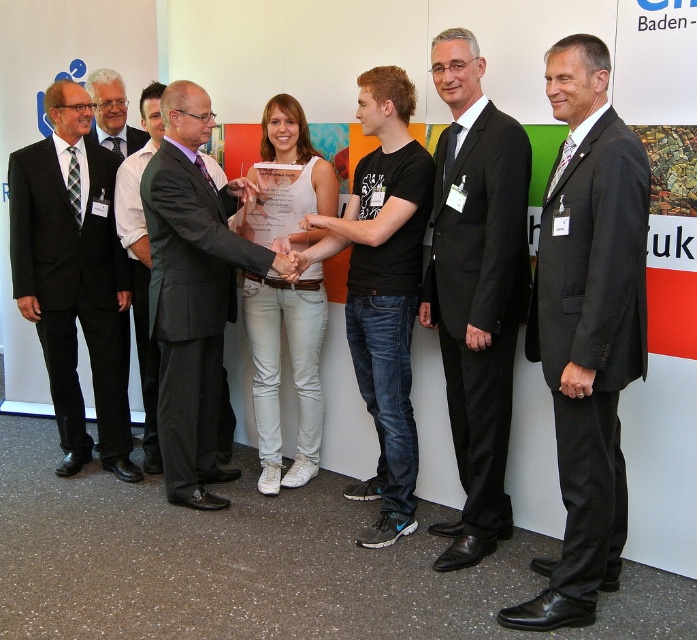
Based on the photo, you are a photographer at the event and need to adjust your camera settings to ensure both the black suit at center and the dark gray suit at left are in focus. Considering their heights, which suit should you focus on first to ensure proper depth of field?

The black suit at center is much taller than the dark gray suit at left. To ensure both are in focus, focus on the black suit at center first, as it is taller and likely farther away, allowing the depth of field to cover the closer, shorter dark gray suit at left.

You are attending a formal event and notice two individuals in suits. The black suit at right and the dark gray suit at center. From your perspective, which one is positioned more to the right side of the scene?

The black suit at right is positioned more to the right side of the scene compared to the dark gray suit at center.

In the scene shown: You are standing at the center of the image. Looking towards the right, you see a point marked at coordinates (588, 326). What object is located at this point?

The point at coordinates (588, 326) marks the location of the black suit at right.